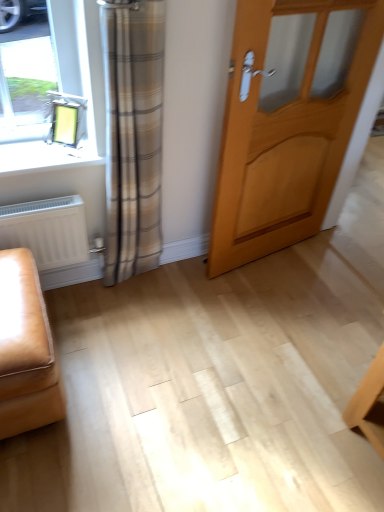
This screenshot has width=384, height=512. Find the location of `free space in front of light wood door at center`. free space in front of light wood door at center is located at coordinates (279, 312).